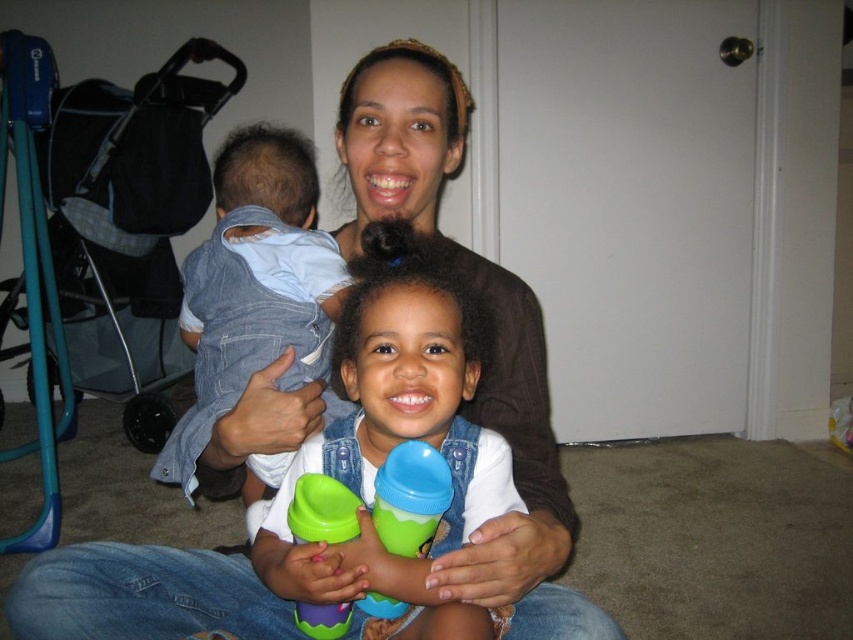
Is matte brown shirt at center wider than green plastic sippy cup at center?

Indeed, matte brown shirt at center has a greater width compared to green plastic sippy cup at center.

Locate an element on the screen. Image resolution: width=853 pixels, height=640 pixels. matte brown shirt at center is located at coordinates (520, 483).

Find the location of a particular element. The height and width of the screenshot is (640, 853). matte brown shirt at center is located at coordinates (520, 483).

Between green plastic sippy cups at center and denim at left, which one is positioned lower?

green plastic sippy cups at center is lower down.

Is point (502, 470) positioned before point (312, 179)?

That is True.

Does point (502, 508) come farther from viewer compared to point (189, 292)?

No, it is not.

In order to click on green plastic sippy cups at center in this screenshot , I will do `click(398, 433)`.

Does green plastic sippy cups at center have a greater width compared to green rubber sippy cup at center?

Indeed, green plastic sippy cups at center has a greater width compared to green rubber sippy cup at center.

Between green plastic sippy cups at center and green rubber sippy cup at center, which one has less height?

With less height is green rubber sippy cup at center.

Where is `green plastic sippy cups at center`? The image size is (853, 640). green plastic sippy cups at center is located at coordinates (398, 433).